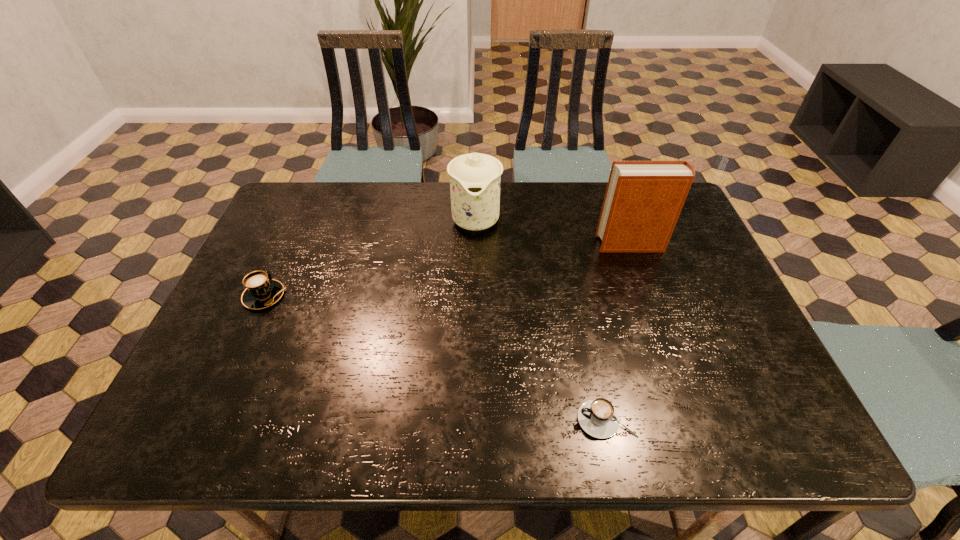
Find the location of a particular element. vacant region at the left edge of the desktop is located at coordinates [269, 359].

In the image, there is a desktop. Identify the location of vacant space at the right edge. The image size is (960, 540). (684, 307).

You are a GUI agent. You are given a task and a screenshot of the screen. Output one action in this format:
    pyautogui.click(x=<x>, y=<y>)
    Task: Click on the vacant space at the far left corner of the desktop
    The width and height of the screenshot is (960, 540).
    Given the screenshot: What is the action you would take?
    pyautogui.click(x=300, y=228)

Image resolution: width=960 pixels, height=540 pixels. I want to click on vacant space that is in between the third object from left to right and the third object from right to left, so click(x=540, y=319).

Locate an element on the screen. This screenshot has height=540, width=960. unoccupied position between the third object from right to left and the rightmost object is located at coordinates (553, 232).

The height and width of the screenshot is (540, 960). What are the coordinates of `vacant space in between the second object from left to right and the hardback book` in the screenshot? It's located at (553, 232).

The image size is (960, 540). What are the coordinates of `unoccupied position between the nearest object and the second nearest object` in the screenshot? It's located at (435, 358).

The image size is (960, 540). Find the location of `empty space between the third tallest object and the rightmost object`. empty space between the third tallest object and the rightmost object is located at coordinates (447, 270).

At what (x,y) coordinates should I click in order to perform the action: click on empty space that is in between the taller cappuccino and the rightmost object. Please return your answer as a coordinate pair (x, y). This screenshot has width=960, height=540. Looking at the image, I should click on (447, 270).

Find the location of a particular element. free spot between the chinaware and the rightmost object is located at coordinates (553, 232).